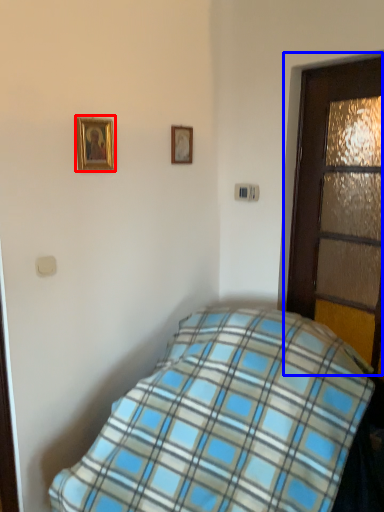
Question: Which object is further to the camera taking this photo, picture frame (highlighted by a red box) or door (highlighted by a blue box)?

Choices:
 (A) picture frame
 (B) door

Answer: (A)